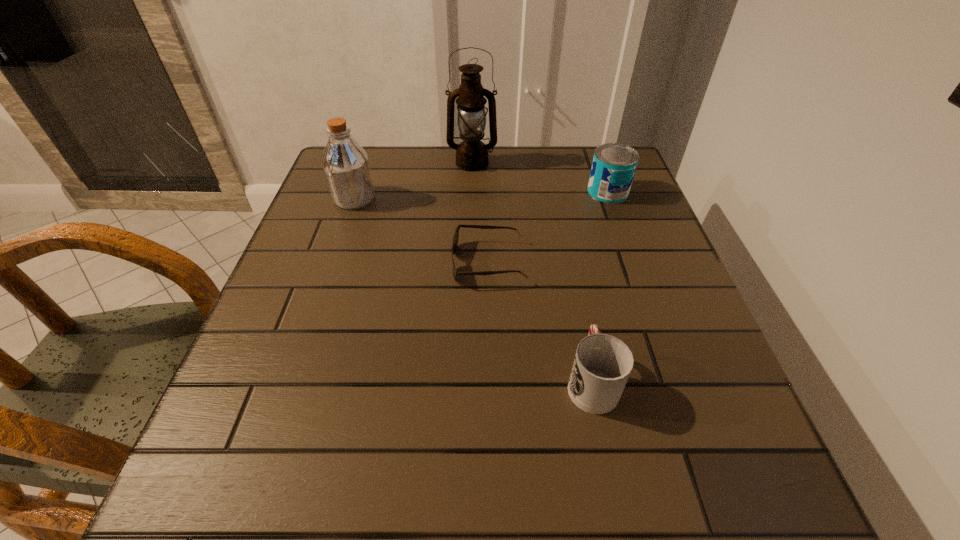
In order to click on oil lamp in this screenshot , I will do `click(471, 154)`.

The height and width of the screenshot is (540, 960). In order to click on the farthest object in this screenshot , I will do `click(471, 154)`.

Identify the location of the leftmost object. (346, 166).

Where is `the second tallest object`? Image resolution: width=960 pixels, height=540 pixels. the second tallest object is located at coordinates (346, 166).

This screenshot has width=960, height=540. I want to click on the rightmost object, so click(614, 164).

The image size is (960, 540). I want to click on the nearest object, so click(602, 365).

This screenshot has height=540, width=960. Find the location of `the fourth object from left to right`. the fourth object from left to right is located at coordinates (602, 365).

Locate an element on the screen. This screenshot has height=540, width=960. the fourth farthest object is located at coordinates (456, 236).

Where is `sunglasses`? sunglasses is located at coordinates (456, 236).

This screenshot has width=960, height=540. Find the location of `vacant space positioned 0.250m on the front of the farthest object`. vacant space positioned 0.250m on the front of the farthest object is located at coordinates (470, 231).